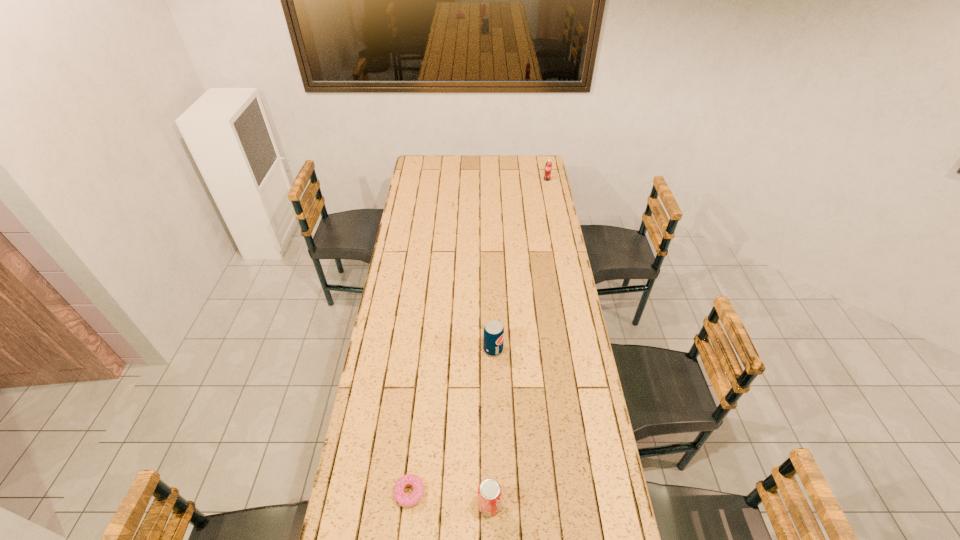
You are a GUI agent. You are given a task and a screenshot of the screen. Output one action in this format:
    pyautogui.click(x=<x>, y=<y>)
    Task: Click on the vacant space that is in between the second farthest object and the nearest soda can
    The width and height of the screenshot is (960, 540).
    Given the screenshot: What is the action you would take?
    pyautogui.click(x=492, y=427)

Where is `vacant point located between the rightmost soda can and the doughnut`? This screenshot has height=540, width=960. vacant point located between the rightmost soda can and the doughnut is located at coordinates (478, 336).

Locate an element on the screen. This screenshot has height=540, width=960. free spot between the rightmost object and the nearest soda can is located at coordinates (518, 342).

This screenshot has height=540, width=960. I want to click on vacant point located between the shortest object and the rightmost soda can, so click(x=478, y=336).

I want to click on free space between the nearest soda can and the third nearest object, so click(492, 427).

You are a GUI agent. You are given a task and a screenshot of the screen. Output one action in this format:
    pyautogui.click(x=<x>, y=<y>)
    Task: Click on the vacant region between the nearest soda can and the farthest object
    This screenshot has height=540, width=960.
    Given the screenshot: What is the action you would take?
    coord(518,342)

This screenshot has width=960, height=540. I want to click on empty location between the nearest soda can and the rightmost soda can, so click(518, 342).

I want to click on object that is the nearest to the rightmost soda can, so click(493, 335).

At what (x,y) coordinates should I click in order to perform the action: click on the closest object to the farthest object. Please return your answer as a coordinate pair (x, y). The image size is (960, 540). Looking at the image, I should click on (493, 335).

The image size is (960, 540). Identify the location of soda can that is the nearest to the third nearest object. (489, 491).